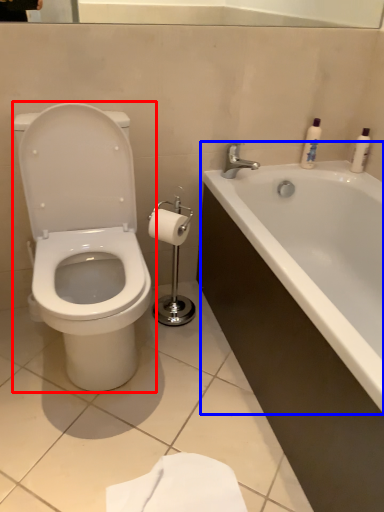
Question: Which object is further to the camera taking this photo, toilet (highlighted by a red box) or bathtub (highlighted by a blue box)?

Choices:
 (A) toilet
 (B) bathtub

Answer: (A)